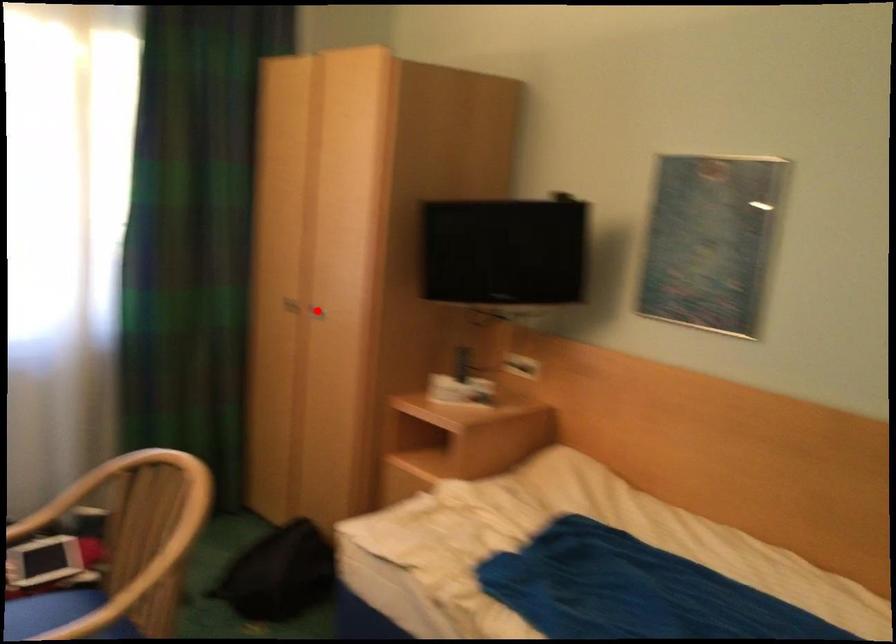
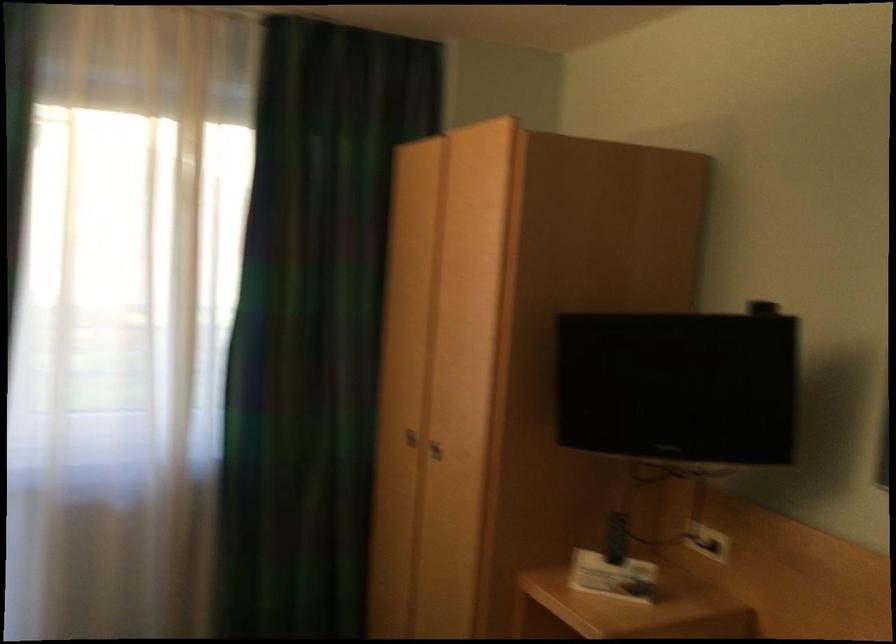
Question: I am providing you with two images of the same scene from different viewpoints. Image1 has a red point marked. In image2, the corresponding 3D location appears at what relative position? Reply with the corresponding letter.

Choices:
 (A) Closer
 (B) Farther

Answer: (A)